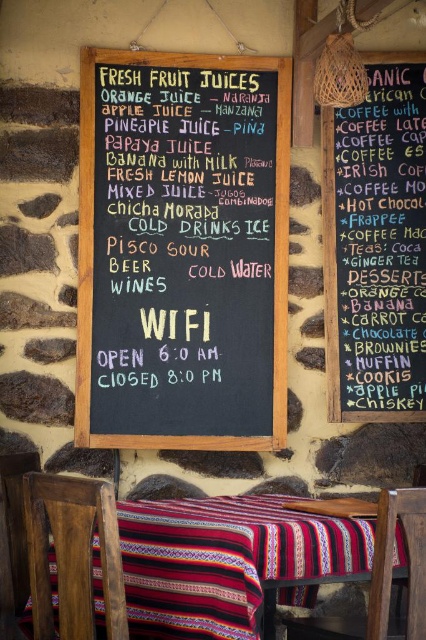
Does black chalkboard at center appear over black chalkboard menu at upper right?

Actually, black chalkboard at center is below black chalkboard menu at upper right.

Can you confirm if black chalkboard at center is positioned to the left of black chalkboard menu at upper right?

Indeed, black chalkboard at center is positioned on the left side of black chalkboard menu at upper right.

Between point (221, 76) and point (425, 358), which one is positioned in front?

Point (425, 358)

This screenshot has height=640, width=426. What are the coordinates of `black chalkboard at center` in the screenshot? It's located at (183, 250).

Measure the distance between point (224, 285) and camera.

They are 3.59 meters apart.

Does point (180, 77) come farther from viewer compared to point (86, 518)?

Yes, it is behind point (86, 518).

Find the location of a particular element. Image resolution: width=426 pixels, height=640 pixels. black chalkboard at center is located at coordinates (183, 250).

Locate an element on the screen. This screenshot has width=426, height=640. black chalkboard at center is located at coordinates (183, 250).

Consider the image. Does striped fabric tablecloth at lower center have a lesser width compared to dark brown wooden chair at lower left?

In fact, striped fabric tablecloth at lower center might be wider than dark brown wooden chair at lower left.

Which is behind, point (154, 586) or point (103, 515)?

Positioned behind is point (154, 586).

Where is `striped fabric tablecloth at lower center`? This screenshot has width=426, height=640. striped fabric tablecloth at lower center is located at coordinates (229, 561).